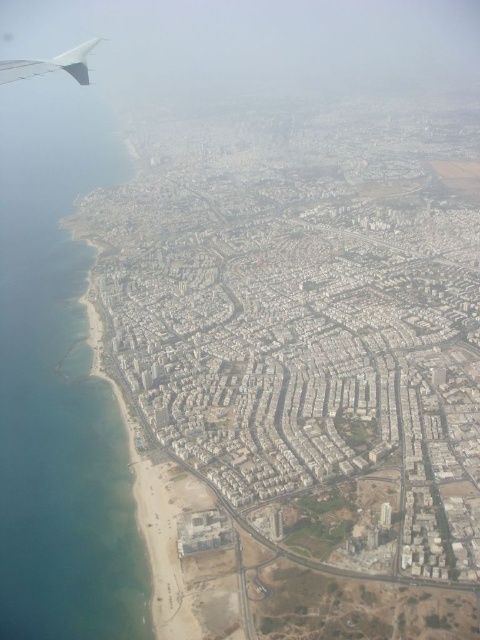
Does blue water at left have a larger size compared to matte gray winglet at upper left?

Yes, blue water at left is bigger than matte gray winglet at upper left.

What do you see at coordinates (59, 392) in the screenshot? The height and width of the screenshot is (640, 480). I see `blue water at left` at bounding box center [59, 392].

Image resolution: width=480 pixels, height=640 pixels. I want to click on blue water at left, so click(x=59, y=392).